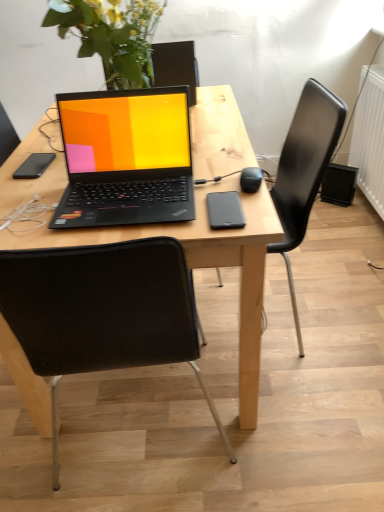
Where is `free location to the right of black plastic chair at center, the 2th chair when ordered from left to right`? Image resolution: width=384 pixels, height=512 pixels. free location to the right of black plastic chair at center, the 2th chair when ordered from left to right is located at coordinates (338, 286).